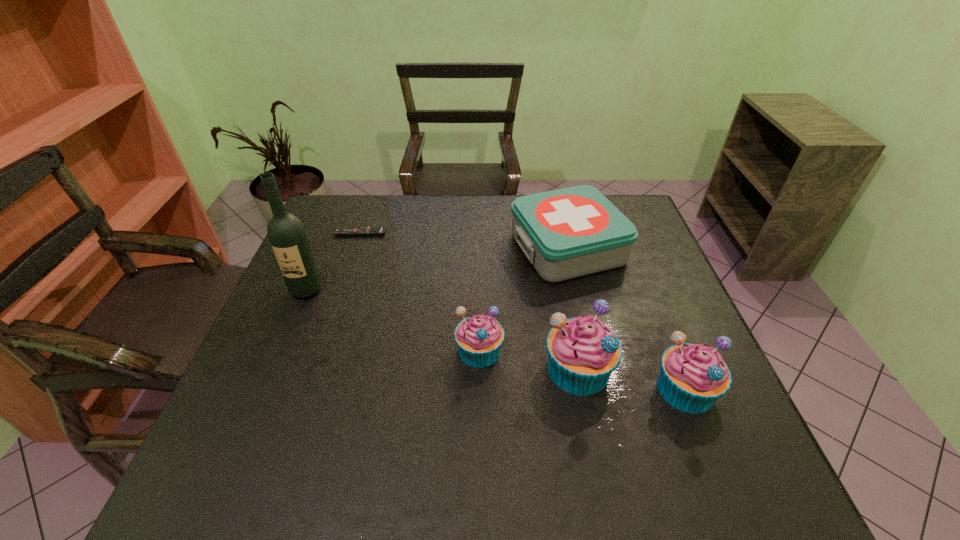
I want to click on the fourth object from right to left, so click(x=479, y=338).

Find the location of a particular element. Image resolution: width=960 pixels, height=540 pixels. the shortest muffin is located at coordinates (479, 338).

Image resolution: width=960 pixels, height=540 pixels. What are the coordinates of `the second muffin from left to right` in the screenshot? It's located at (583, 352).

This screenshot has width=960, height=540. In order to click on the third tallest object in this screenshot , I will do `click(693, 376)`.

This screenshot has width=960, height=540. Find the location of `the rightmost muffin`. the rightmost muffin is located at coordinates (693, 376).

This screenshot has height=540, width=960. What are the coordinates of `the first-aid kit` in the screenshot? It's located at (576, 231).

Identify the location of remote control. This screenshot has width=960, height=540. (378, 230).

Identify the location of the tallest object. (287, 236).

At what (x,y) coordinates should I click in order to perform the action: click on free space located on the left of the shortest muffin. Please return your answer as a coordinate pair (x, y). This screenshot has width=960, height=540. Looking at the image, I should click on (391, 350).

Image resolution: width=960 pixels, height=540 pixels. Find the location of `free point located on the left of the second muffin from left to right`. free point located on the left of the second muffin from left to right is located at coordinates (463, 369).